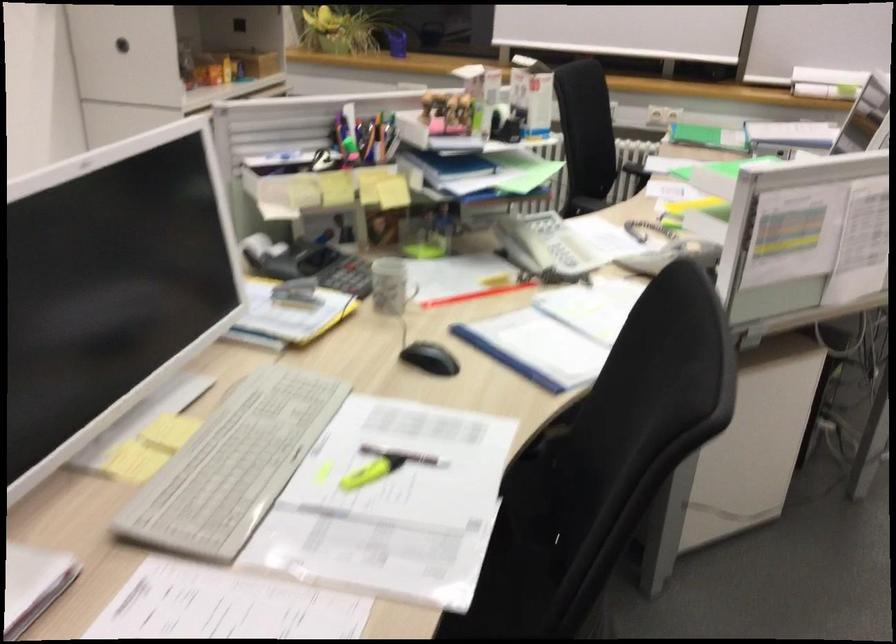
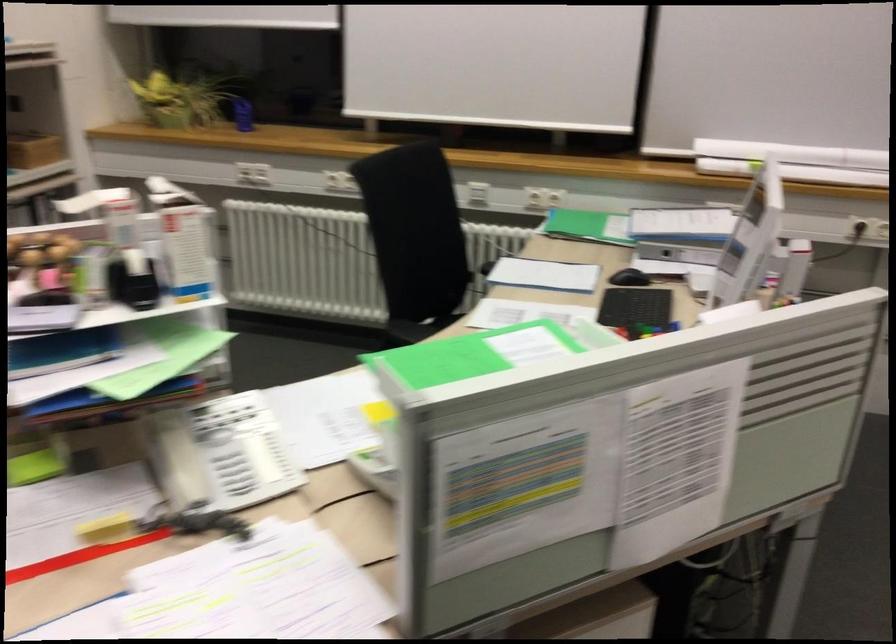
Question: Based on the continuous images, in which direction is the camera rotating? Reply with the corresponding letter.

Choices:
 (A) Left
 (B) Right
 (C) Up
 (D) Down

Answer: (C)